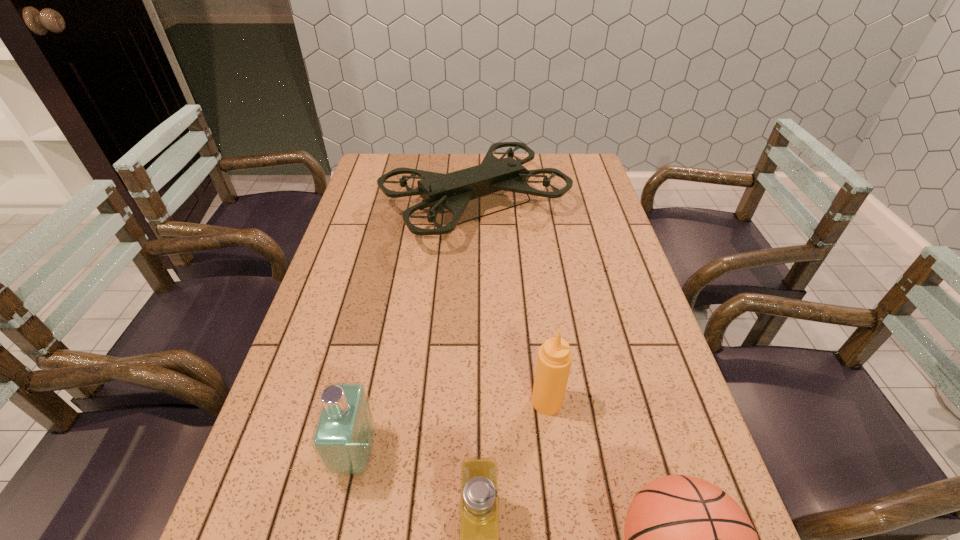
Identify the location of perfume that is positioned at the left edge. This screenshot has width=960, height=540. (343, 438).

Locate an element on the screen. The width and height of the screenshot is (960, 540). object that is at the right edge is located at coordinates (452, 191).

Image resolution: width=960 pixels, height=540 pixels. Identify the location of object that is at the far left corner. (452, 191).

Locate an element on the screen. Image resolution: width=960 pixels, height=540 pixels. object that is at the far right corner is located at coordinates (452, 191).

In the image, there is a desktop. Where is `vacant space at the far edge`? This screenshot has height=540, width=960. vacant space at the far edge is located at coordinates (546, 159).

The image size is (960, 540). In order to click on free space at the left edge of the desktop in this screenshot , I will do `click(325, 335)`.

Image resolution: width=960 pixels, height=540 pixels. What are the coordinates of `free space at the right edge of the desktop` in the screenshot? It's located at [x=582, y=258].

In order to click on vacant region at the far left corner of the desktop in this screenshot , I will do `click(376, 186)`.

Where is `free location at the far right corner of the desktop`? The height and width of the screenshot is (540, 960). free location at the far right corner of the desktop is located at coordinates (566, 157).

This screenshot has height=540, width=960. Find the location of `unoccupied area between the farthest object and the second farthest object`. unoccupied area between the farthest object and the second farthest object is located at coordinates [511, 303].